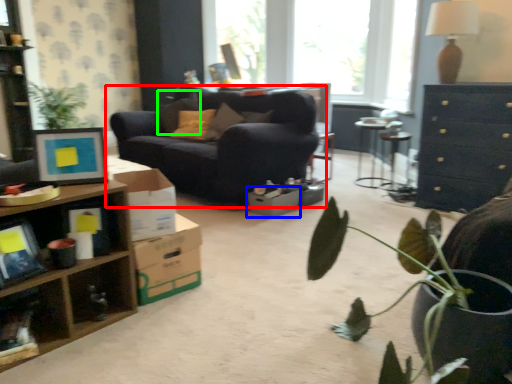
Question: Considering the real-world distances, which object is closest to studio couch (highlighted by a red box)? cardboard box (highlighted by a blue box) or pillow (highlighted by a green box).

Choices:
 (A) cardboard box
 (B) pillow

Answer: (A)